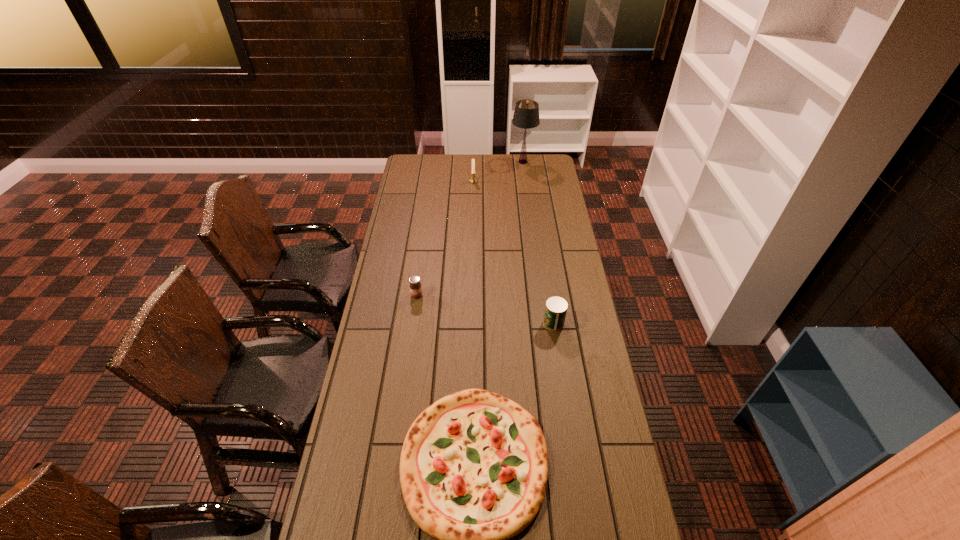
The image size is (960, 540). Identify the location of the tallest object. (526, 114).

The image size is (960, 540). In order to click on lampshade in this screenshot , I will do `click(526, 114)`.

This screenshot has height=540, width=960. Find the location of `the second tallest object`. the second tallest object is located at coordinates (472, 180).

What are the coordinates of `candle holder` in the screenshot? It's located at (472, 180).

The image size is (960, 540). In order to click on the third shortest object in this screenshot , I will do `click(556, 307)`.

This screenshot has width=960, height=540. In order to click on the second nearest object in this screenshot , I will do `click(556, 307)`.

At what (x,y) coordinates should I click in order to perform the action: click on the third farthest object. Please return your answer as a coordinate pair (x, y). The width and height of the screenshot is (960, 540). Looking at the image, I should click on [415, 286].

Image resolution: width=960 pixels, height=540 pixels. What are the coordinates of `jam` in the screenshot? It's located at (415, 286).

Where is `vacant space situated 0.060m on the front-facing side of the tallest object`? vacant space situated 0.060m on the front-facing side of the tallest object is located at coordinates (500, 162).

You are a GUI agent. You are given a task and a screenshot of the screen. Output one action in this format:
    pyautogui.click(x=<x>, y=<y>)
    Task: Click on the vacant space positioned on the front-facing side of the tallest object
    
    Given the screenshot: What is the action you would take?
    pyautogui.click(x=490, y=162)